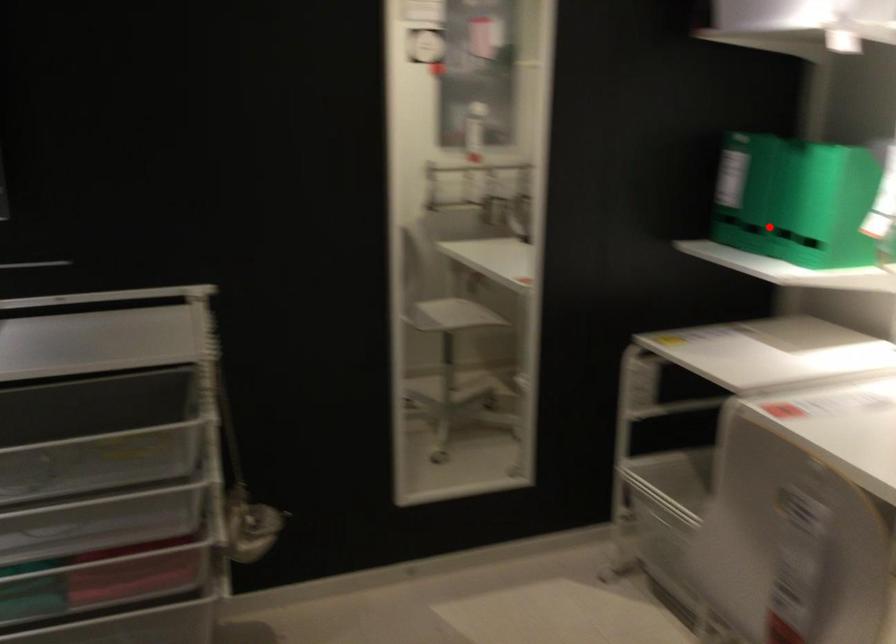
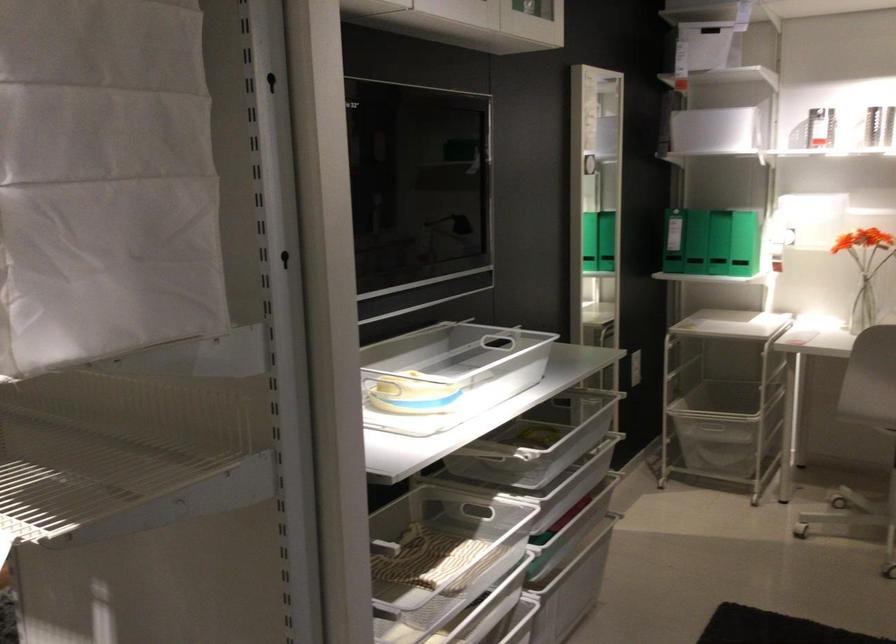
Question: I am providing you with two images of the same scene from different viewpoints. Given a red point in image1, look at the same physical point in image2. Is it:

Choices:
 (A) Closer to the viewpoint
 (B) Farther from the viewpoint

Answer: (B)